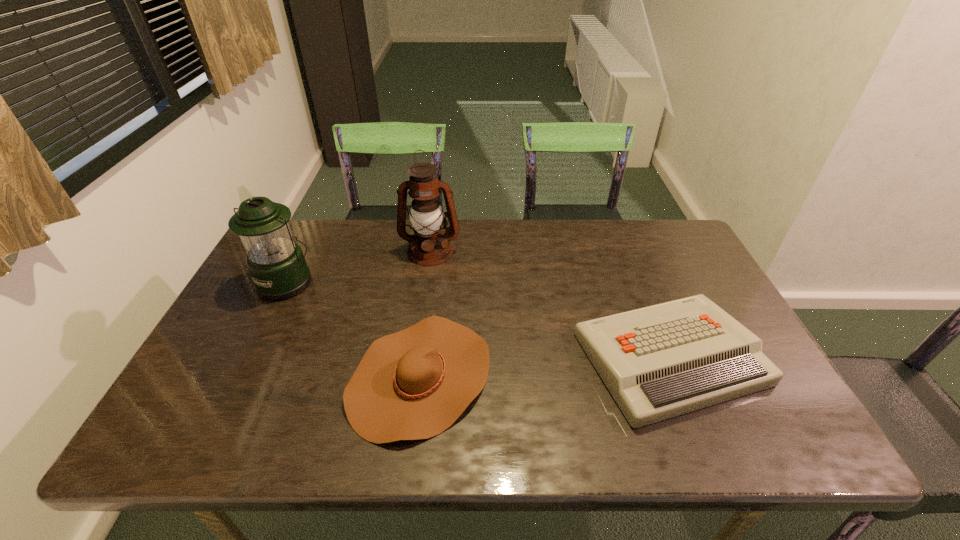
Locate an element on the screen. Image resolution: width=960 pixels, height=540 pixels. empty space that is in between the cowboy hat and the computer keyboard is located at coordinates (545, 367).

Locate which object is the third closest to the shorter lantern. Please provide its 2D coordinates. Your answer should be formatted as a tuple, i.e. [(x, y)], where the tuple contains the x and y coordinates of a point satisfying the conditions above.

[(658, 362)]

Identify which object is the third nearest to the tallest object. Please provide its 2D coordinates. Your answer should be formatted as a tuple, i.e. [(x, y)], where the tuple contains the x and y coordinates of a point satisfying the conditions above.

[(658, 362)]

Where is `free point that satisfies the following two spatial constraints: 1. on the side of the taller lantern, there is a wick adjustment knob; 2. on the right side of the cowboy hat`? This screenshot has height=540, width=960. free point that satisfies the following two spatial constraints: 1. on the side of the taller lantern, there is a wick adjustment knob; 2. on the right side of the cowboy hat is located at coordinates (413, 376).

Find the location of a particular element. The image size is (960, 540). vacant point that satisfies the following two spatial constraints: 1. on the side of the cowboy hat, there is a wick adjustment knob; 2. on the left side of the tallest object is located at coordinates (413, 376).

Find the location of `free space that satisfies the following two spatial constraints: 1. on the side of the tallest object, there is a wick adjustment knob; 2. on the right side of the cowboy hat`. free space that satisfies the following two spatial constraints: 1. on the side of the tallest object, there is a wick adjustment knob; 2. on the right side of the cowboy hat is located at coordinates (413, 376).

This screenshot has width=960, height=540. Identify the location of free region that satisfies the following two spatial constraints: 1. on the side of the rightmost object, there is a wick adjustment knob; 2. on the right side of the taller lantern. (416, 358).

Locate an element on the screen. free space that satisfies the following two spatial constraints: 1. on the side of the taller lantern, there is a wick adjustment knob; 2. on the right side of the computer keyboard is located at coordinates (416, 358).

Find the location of a particular element. free region that satisfies the following two spatial constraints: 1. on the side of the computer keyboard, there is a wick adjustment knob; 2. on the left side of the right lantern is located at coordinates (416, 358).